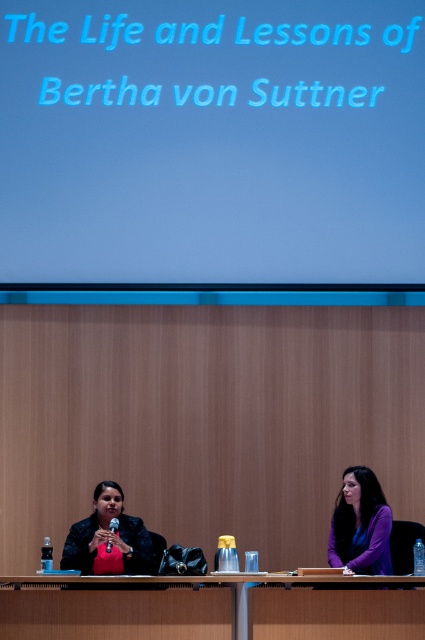
Based on the scene description, where is the blue matte projection screen at upper center located in terms of its 2D coordinates?

The blue matte projection screen at upper center is located at the 2D coordinates of point [212,141].

You are an event planner setting up a new conference room. You need to place a speaker podium such that it is directly in front of the blue matte projection screen at upper center. Given that the screen is at point coordinates of 0.223, 0.499, where should you position the podium to ensure it is centered and aligned with the screen?

The podium should be positioned directly in front of the blue matte projection screen at upper center, which is located at coordinates (212, 141). Aligning the podium at this point ensures it is centered and properly aligned with the screen.